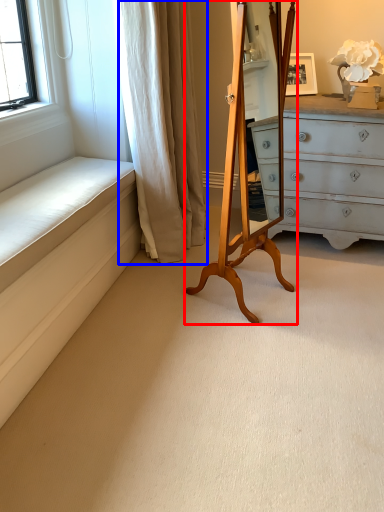
Question: Which of the following is the closest to the observer, easel (highlighted by a red box) or curtain (highlighted by a blue box)?

Choices:
 (A) easel
 (B) curtain

Answer: (A)